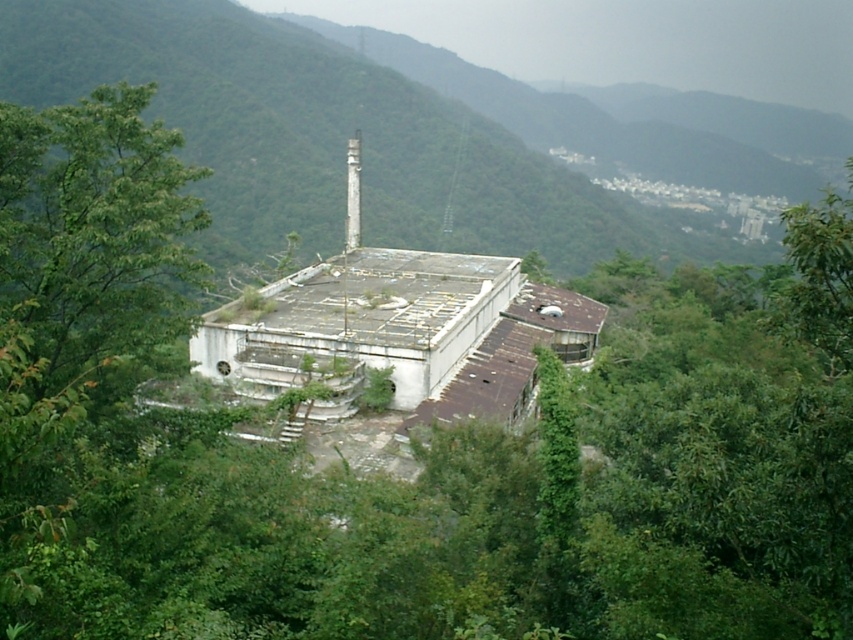
Question: Does green mossy roof at center appear on the left side of white smooth chimney at center?

Choices:
 (A) no
 (B) yes

Answer: (A)

Question: Which of the following is the farthest from the observer?

Choices:
 (A) (593, 116)
 (B) (346, 172)

Answer: (A)

Question: In this image, where is green mossy roof at center located relative to white smooth chimney at center?

Choices:
 (A) right
 (B) left

Answer: (A)

Question: Is green mossy roof at center smaller than white smooth chimney at center?

Choices:
 (A) no
 (B) yes

Answer: (A)